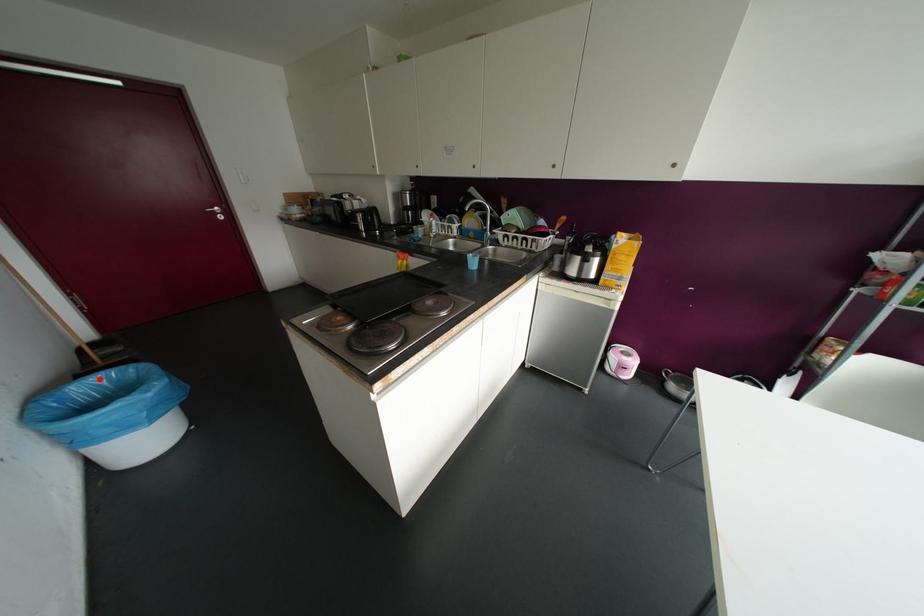
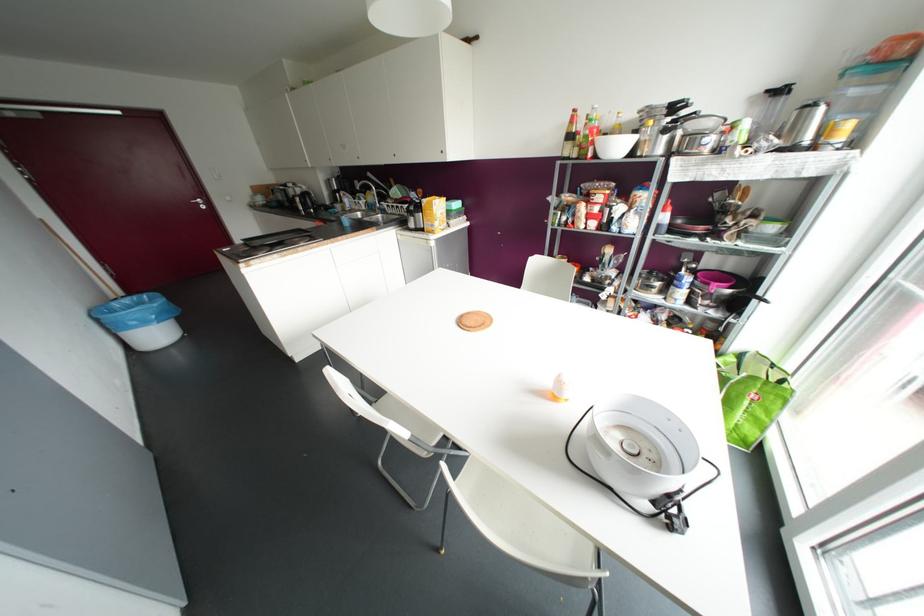
In the second image, find the point that corresponds to the highlighted location in the first image.

(127, 300)